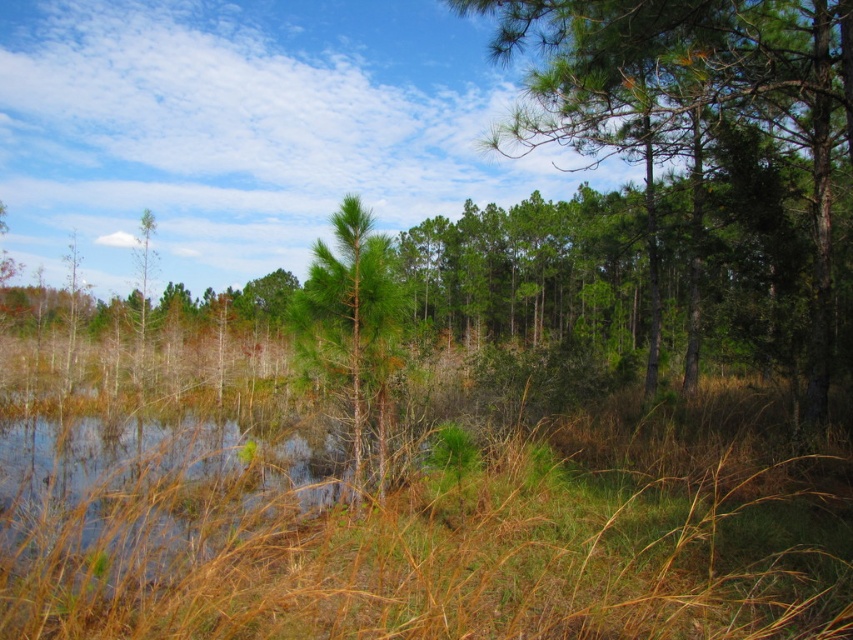
Between point (811, 396) and point (379, 477), which one is positioned in front?

Point (379, 477)

I want to click on green leafy tree at center, so click(706, 129).

Which is behind, point (735, 257) or point (355, 196)?

Point (735, 257)

Find the location of a particular element. The image size is (853, 640). green leafy tree at center is located at coordinates (706, 129).